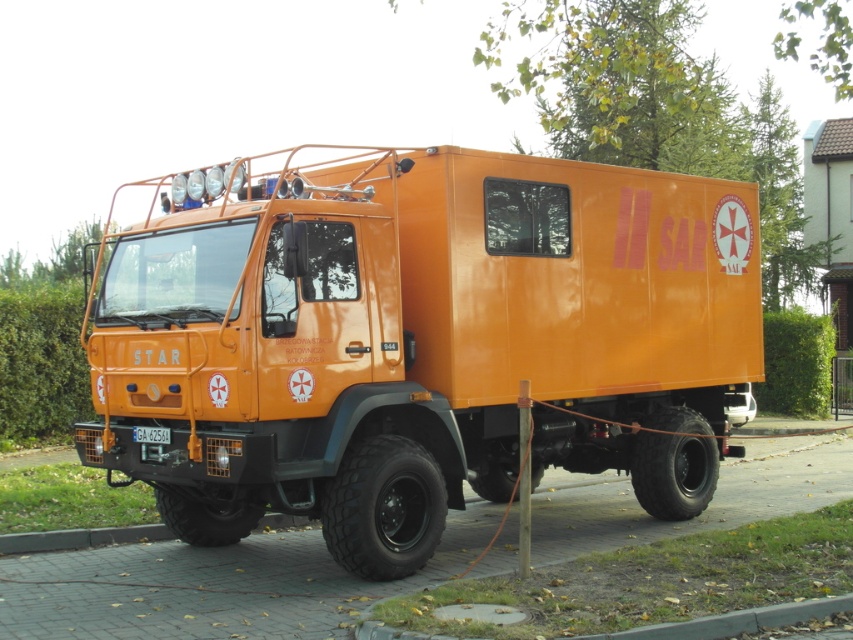
You are a delivery driver who needs to attach a magnetic sign to the orange matte truck at center. The sign requires a metal surface to stick. Is the white plastic license plate at center a suitable place to attach the sign?

The white plastic license plate at center is made of plastic, so the magnetic sign won material requirements. The orange matte truck at center has a metal surface, so the magnetic sign will stick properly there.

You are standing in front of the orange utility vehicle and want to touch both points on the truck. Which point should you reach for first, the point at coordinate (151, 326) or the point at coordinate (169, 428)?

You should reach for point (151, 326) first because it is closer to you than point (169, 428), which is further away.